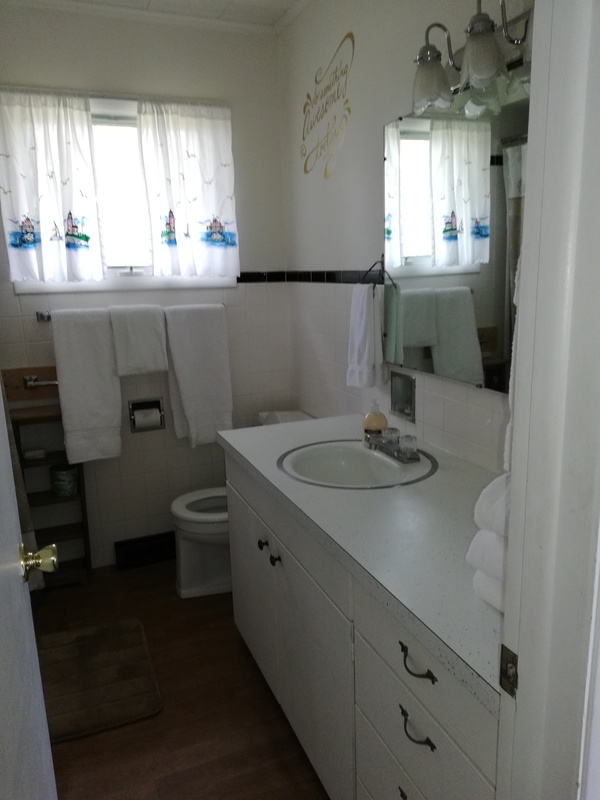
Where is `mirror`? mirror is located at coordinates 478,316.